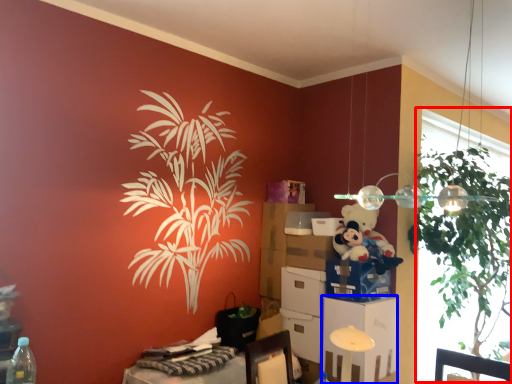
Question: Among these objects, which one is nearest to the camera, window screen (highlighted by a red box) or file cabinet (highlighted by a blue box)?

Choices:
 (A) window screen
 (B) file cabinet

Answer: (A)